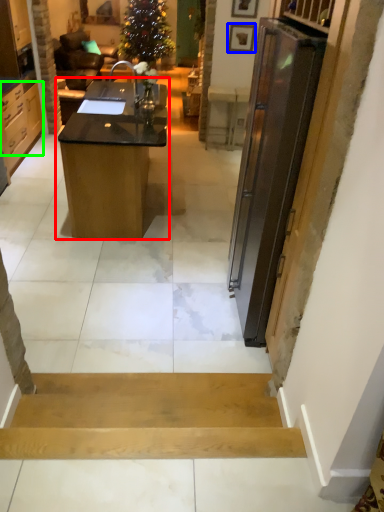
Question: Considering the real-world distances, which object is farthest from desk (highlighted by a red box)? picture frame (highlighted by a blue box) or cabinetry (highlighted by a green box)?

Choices:
 (A) picture frame
 (B) cabinetry

Answer: (A)